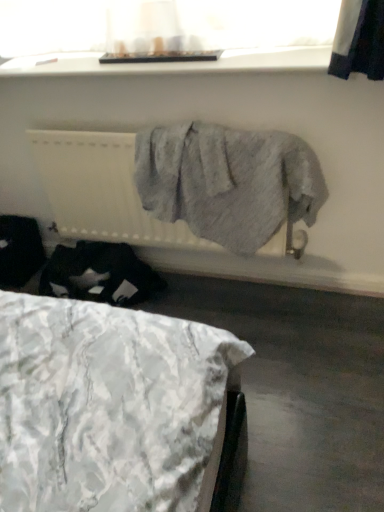
Question: Considering their positions, is white smooth window sill at upper center located in front of or behind white textured fabric at lower left?

Choices:
 (A) front
 (B) behind

Answer: (B)

Question: Visually, is white smooth window sill at upper center positioned to the left or to the right of white textured fabric at lower left?

Choices:
 (A) left
 (B) right

Answer: (B)

Question: Estimate the real-world distances between objects in this image. Which object is closer to the translucent fabric at upper center?

Choices:
 (A) white smooth window sill at upper center
 (B) white textured radiator at center
 (C) white textured fabric at lower left

Answer: (A)

Question: Considering the real-world distances, which object is closest to the white textured fabric at lower left?

Choices:
 (A) translucent fabric at upper center
 (B) white textured radiator at center
 (C) white smooth window sill at upper center

Answer: (B)